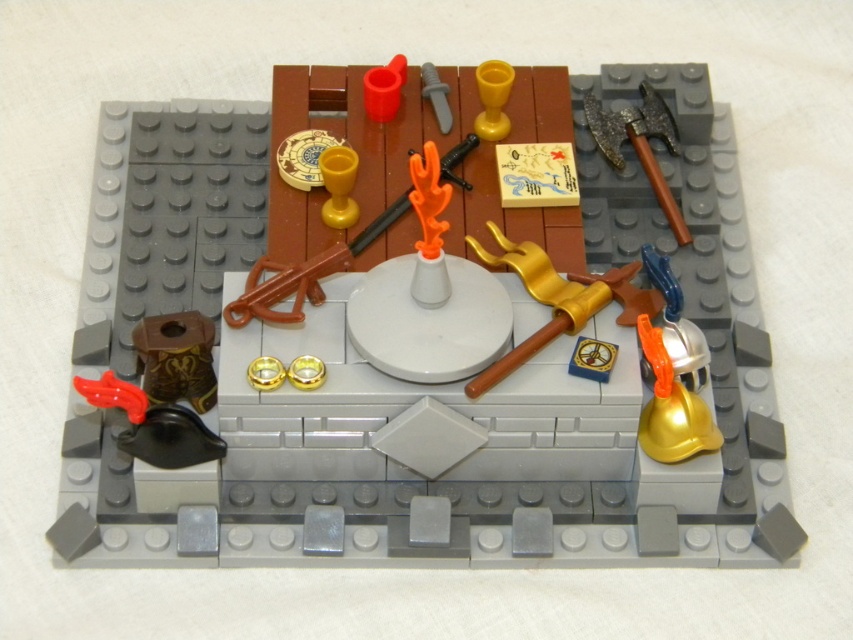
Question: Can you confirm if smooth brown cup at upper center is wider than gold metallic sword at center-right?

Choices:
 (A) yes
 (B) no

Answer: (A)

Question: Which point is farther to the camera?

Choices:
 (A) (607, 112)
 (B) (553, 301)
 (C) (437, 561)
 (D) (383, 211)

Answer: (A)

Question: Where is orange plastic torch at center located in relation to dark brown wood axe at upper right in the image?

Choices:
 (A) left
 (B) right

Answer: (A)

Question: Can you confirm if gold metallic sword at center-right is wider than orange plastic torch at center?

Choices:
 (A) yes
 (B) no

Answer: (B)

Question: Which object is the closest to the dark brown wood axe at upper right?

Choices:
 (A) orange plastic torch at center
 (B) gold metallic sword at center-right
 (C) smooth brown cup at upper center

Answer: (B)

Question: Which point is farther from the camera taking this photo?

Choices:
 (A) (730, 396)
 (B) (592, 125)

Answer: (B)